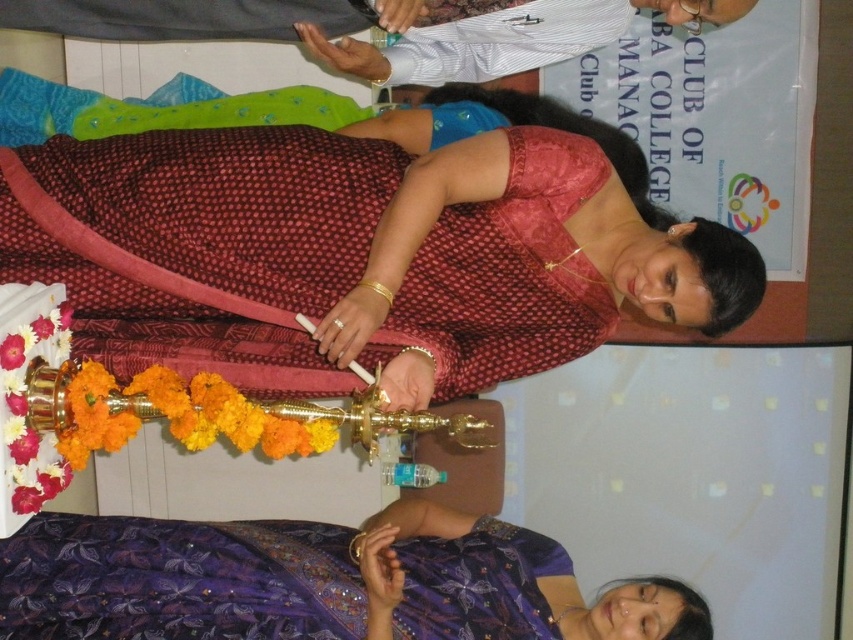
You are a photographer at the event and need to ensure both the maroon printed saree at center and the purple sequined saree at lower left are visible in your shot. Given that your camera can only focus on objects within a 1.2 meter width, will both sarees fit in the frame?

The maroon printed saree at center is smaller than the purple sequined saree at lower left. Since the camera can focus on objects within a 1.2 meter width, both sarees can fit in the frame as their combined size is likely within the limit.

You are a photographer at the event and need to capture a closeup shot of both the maroon printed saree at center and the purple sequined saree at lower left. Given that your camera has a depth of field that can focus on objects within a 25 inch range, will both sarees be in focus?

The maroon printed saree at center is 25.15 inches away from the purple sequined saree at lower left. Since the distance between them exceeds the camera sensor range of 25 inches, the sarees will not both be in focus simultaneously.